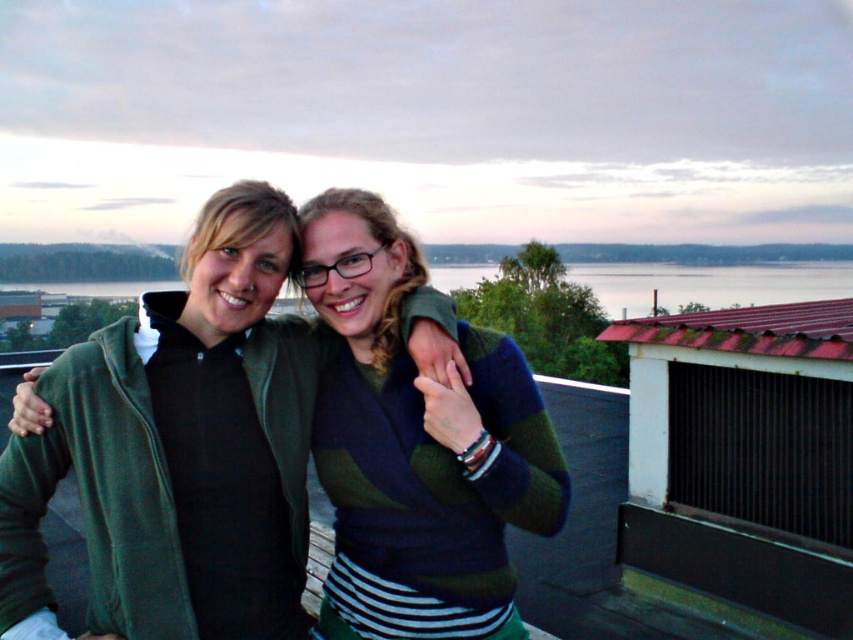
Question: Can you confirm if green fleece jacket at center is positioned below striped sweater at center?

Choices:
 (A) no
 (B) yes

Answer: (A)

Question: Which point is closer to the camera taking this photo?

Choices:
 (A) (175, 620)
 (B) (490, 515)

Answer: (A)

Question: Which point is closer to the camera taking this photo?

Choices:
 (A) (474, 332)
 (B) (241, 566)

Answer: (B)

Question: Is green fleece jacket at center below striped sweater at center?

Choices:
 (A) yes
 (B) no

Answer: (B)

Question: Can you confirm if green fleece jacket at center is positioned to the left of striped sweater at center?

Choices:
 (A) no
 (B) yes

Answer: (B)